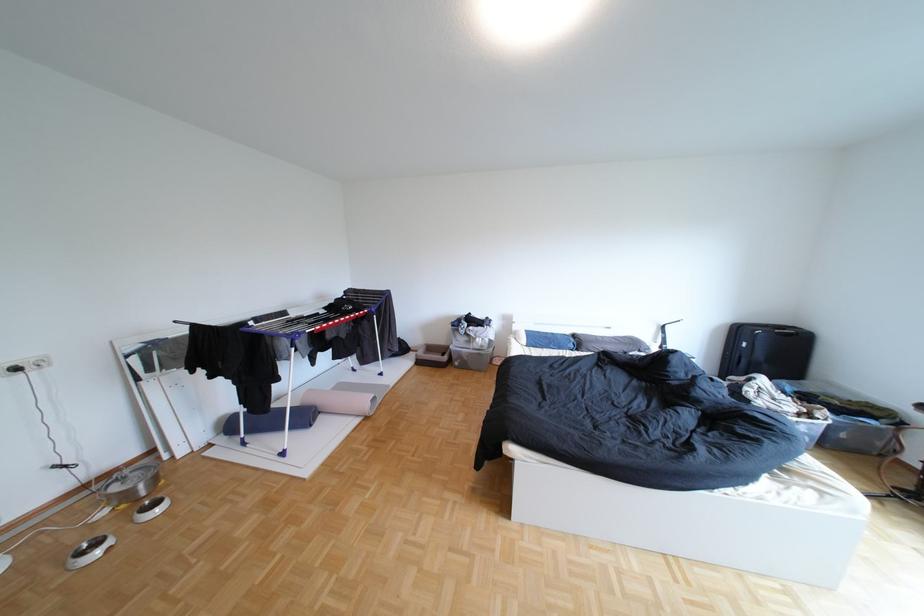
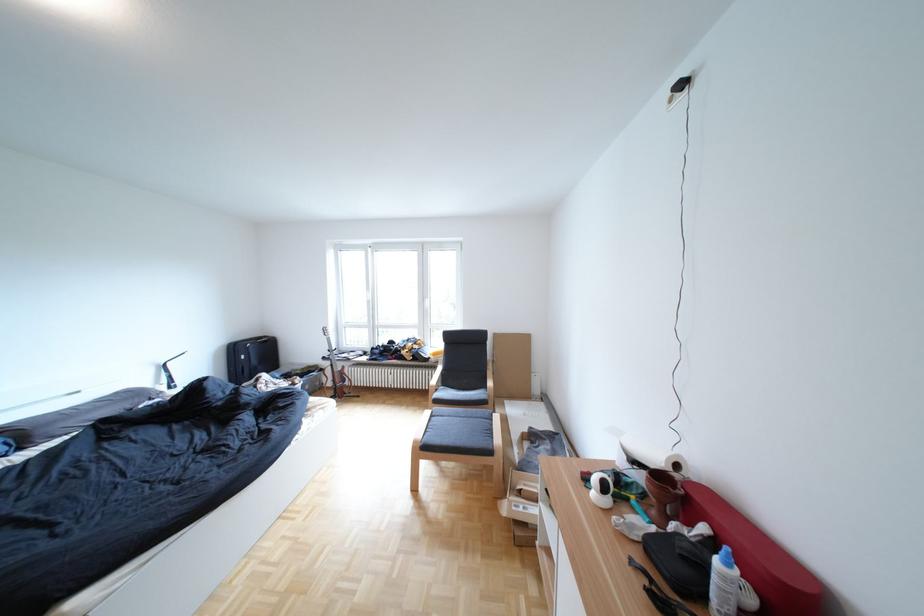
Question: Based on the continuous images, in which direction is the camera rotating? Reply with the corresponding letter.

Choices:
 (A) Left
 (B) Right
 (C) Up
 (D) Down

Answer: (B)